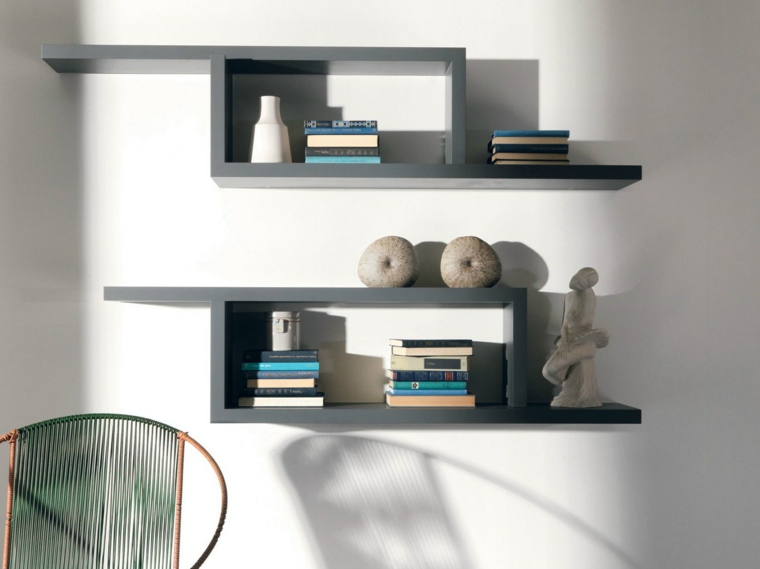
Find the location of a particular element. The image size is (760, 569). book in left stack top shelf is located at coordinates (346, 125), (356, 130), (362, 141), (356, 151), (337, 160).